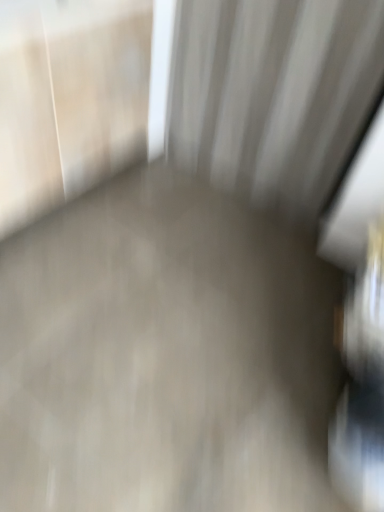
Question: Looking at the image, does smooth concrete floor at center seem bigger or smaller compared to white textured curtain at upper center?

Choices:
 (A) small
 (B) big

Answer: (B)

Question: From a real-world perspective, is smooth concrete floor at center positioned above or below white textured curtain at upper center?

Choices:
 (A) below
 (B) above

Answer: (A)

Question: Looking at their shapes, would you say smooth concrete floor at center is wider or thinner than white textured curtain at upper center?

Choices:
 (A) wide
 (B) thin

Answer: (A)

Question: Would you say white textured curtain at upper center is to the left or to the right of smooth concrete floor at center in the picture?

Choices:
 (A) left
 (B) right

Answer: (B)

Question: In terms of height, does white textured curtain at upper center look taller or shorter compared to smooth concrete floor at center?

Choices:
 (A) tall
 (B) short

Answer: (A)

Question: Relative to smooth concrete floor at center, is white textured curtain at upper center in front or behind?

Choices:
 (A) behind
 (B) front

Answer: (A)

Question: From the image's perspective, is white textured curtain at upper center above or below smooth concrete floor at center?

Choices:
 (A) above
 (B) below

Answer: (A)